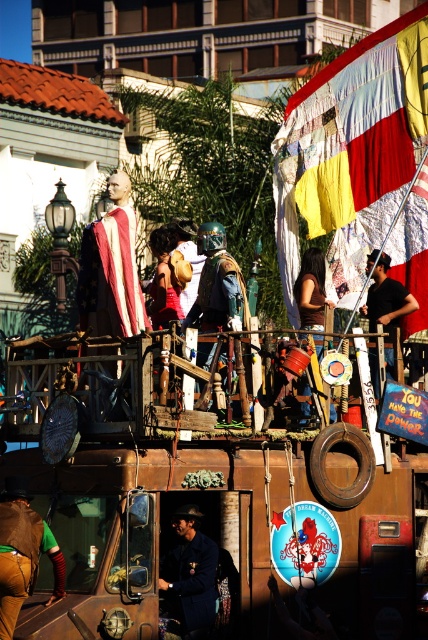
You are standing at the back of the vehicle and want to move towards the front. Which point, point (8, 486) or point (371, 316), will you encounter first?

Point (8, 486) is in front of point (371, 316), so you will encounter point (8, 486) first as you move towards the front of the vehicle.

You are a photographer standing at the origin point of the image. You want to capture the quilted fabric flag at upper right in your shot. What are the coordinates where you should aim your camera?

The quilted fabric flag at upper right is located at coordinates point (x=350, y=150), so you should aim your camera at those coordinates to capture it.